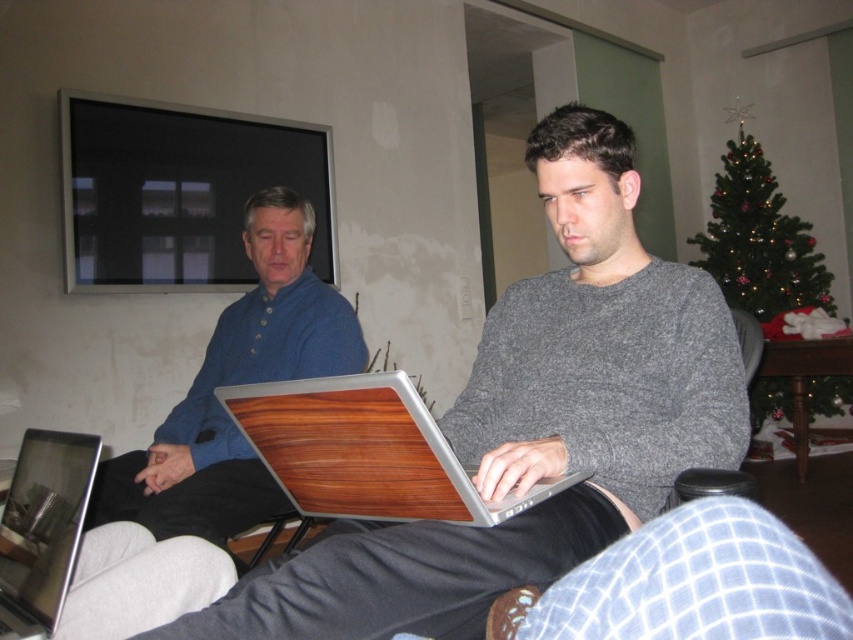
Can you confirm if wooden laptop at lower left is shorter than black leather armchair at lower right?

Correct, wooden laptop at lower left is not as tall as black leather armchair at lower right.

Is wooden laptop at lower left taller than black leather armchair at lower right?

In fact, wooden laptop at lower left may be shorter than black leather armchair at lower right.

The image size is (853, 640). Describe the element at coordinates (42, 529) in the screenshot. I see `wooden laptop at lower left` at that location.

Image resolution: width=853 pixels, height=640 pixels. Identify the location of wooden laptop at lower left. (42, 529).

Image resolution: width=853 pixels, height=640 pixels. What do you see at coordinates (694, 582) in the screenshot? I see `white checkered fabric at lower right` at bounding box center [694, 582].

Which is above, white checkered fabric at lower right or black leather armchair at lower right?

Positioned higher is black leather armchair at lower right.

Locate an element on the screen. This screenshot has width=853, height=640. white checkered fabric at lower right is located at coordinates click(694, 582).

The image size is (853, 640). I want to click on white checkered fabric at lower right, so click(694, 582).

Which of these two, matte wood laptop at center or wooden-textured laptop at center, stands shorter?

wooden-textured laptop at center is shorter.

Does point (495, 568) come closer to viewer compared to point (363, 458)?

Yes, it is.

Is point (544, 401) positioned behind point (393, 516)?

Yes, it is.

I want to click on matte wood laptop at center, so click(x=532, y=422).